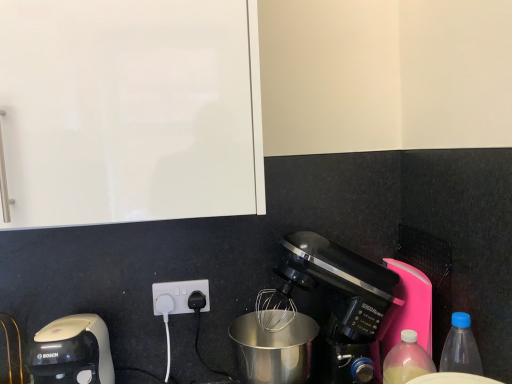
Locate an element on the screen. free spot above white plastic coffee maker at lower left, marked as the 2th coffee maker in a right-to-left arrangement (from a real-world perspective) is located at coordinates (67, 328).